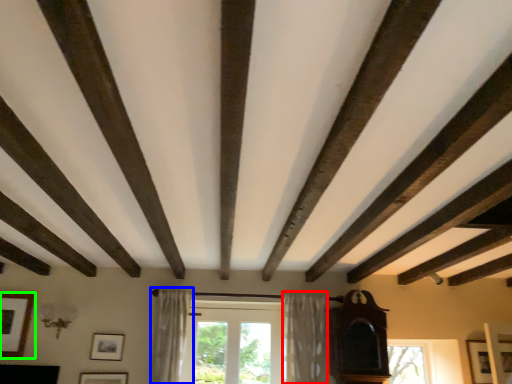
Question: Which is farther away from curtain (highlighted by a red box)? curtain (highlighted by a blue box) or picture frame (highlighted by a green box)?

Choices:
 (A) curtain
 (B) picture frame

Answer: (B)